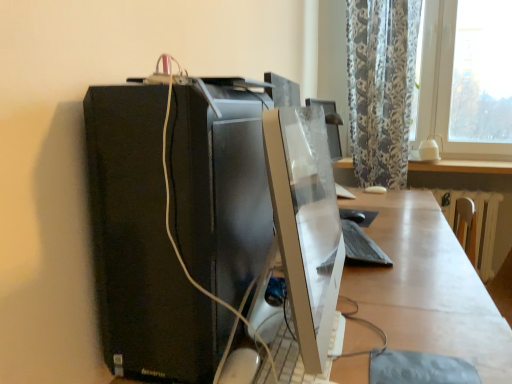
What is the approximate height of white glossy table at lower right?

white glossy table at lower right is 54.20 centimeters tall.

What do you see at coordinates (362, 245) in the screenshot?
I see `black matte keyboard at center` at bounding box center [362, 245].

Image resolution: width=512 pixels, height=384 pixels. Describe the element at coordinates (305, 223) in the screenshot. I see `satin white monitor at center` at that location.

Image resolution: width=512 pixels, height=384 pixels. Describe the element at coordinates (426, 286) in the screenshot. I see `white glossy desk at center` at that location.

The image size is (512, 384). I want to click on black matte computer tower at left, so click(143, 247).

Consider the image. From the image's perspective, which is below, white glossy table at lower right or black matte keyboard at center?

white glossy table at lower right appears lower in the image.

Can we say white glossy table at lower right lies outside black matte keyboard at center?

white glossy table at lower right lies outside black matte keyboard at center's area.

Which object is further away from the camera, white glossy table at lower right or black matte keyboard at center?

black matte keyboard at center.

In order to click on computer monitor in front of the black matte keyboard at center in this screenshot , I will do `click(305, 223)`.

Is black matte keyboard at center looking in the opposite direction of satin white monitor at center?

No, black matte keyboard at center's orientation is not away from satin white monitor at center.

Does point (366, 247) appear closer or farther from the camera than point (269, 164)?

Point (366, 247) is farther from the camera than point (269, 164).

Is black matte keyboard at center not within satin white monitor at center?

Indeed, black matte keyboard at center is completely outside satin white monitor at center.

Is black matte computer tower at left to the left of satin white monitor at center from the viewer's perspective?

A: Indeed, black matte computer tower at left is positioned on the left side of satin white monitor at center.

Does black matte computer tower at left have a lesser width compared to satin white monitor at center?

Incorrect, the width of black matte computer tower at left is not less than that of satin white monitor at center.

Considering the points (157, 148) and (330, 301), which point is behind, point (157, 148) or point (330, 301)?

Positioned behind is point (330, 301).

From a real-world perspective, which is physically below, white glossy desk at center or black matte keyboard at center?

white glossy desk at center is physically lower.

Which object is further away from the camera, white glossy desk at center or black matte keyboard at center?

black matte keyboard at center.

Is white glossy desk at center wider or thinner than black matte keyboard at center?

Considering their sizes, white glossy desk at center looks broader than black matte keyboard at center.

Can you tell me how much white glossy desk at center and black matte keyboard at center differ in facing direction?

There is a 17.7-degree angle between the facing directions of white glossy desk at center and black matte keyboard at center.

In terms of size, does black matte computer tower at left appear bigger or smaller than black matte keyboard at center?

In the image, black matte computer tower at left appears to be larger than black matte keyboard at center.

Would you say black matte keyboard at center is part of black matte computer tower at left's contents?

Definitely not — black matte keyboard at center is not inside black matte computer tower at left.

Is black matte computer tower at left in front of or behind black matte keyboard at center in the image?

black matte computer tower at left is positioned closer to the viewer than black matte keyboard at center.

Considering the sizes of objects satin white monitor at center and white glossy desk at center in the image provided, who is taller, satin white monitor at center or white glossy desk at center?

Standing taller between the two is white glossy desk at center.

Who is smaller, satin white monitor at center or white glossy desk at center?

satin white monitor at center.

Find the location of a particular element. desk directly beneath the satin white monitor at center (from a real-world perspective) is located at coordinates 426,286.

Does black matte keyboard at center have a greater width compared to black matte computer tower at left?

In fact, black matte keyboard at center might be narrower than black matte computer tower at left.

Looking at this image, which of these two, black matte keyboard at center or black matte computer tower at left, stands taller?

With more height is black matte computer tower at left.

Is black matte keyboard at center directly adjacent to black matte computer tower at left?

No.

Does black matte keyboard at center appear on the left side of black matte computer tower at left?

In fact, black matte keyboard at center is to the right of black matte computer tower at left.

Locate an element on the screen. table below the black matte keyboard at center (from a real-world perspective) is located at coordinates (426, 286).

This screenshot has width=512, height=384. In order to click on computer keyboard behind the satin white monitor at center in this screenshot , I will do `click(362, 245)`.

Looking at the image, which one is located further to black matte computer tower at left, white glossy table at lower right or white glossy desk at center?

white glossy desk at center is further to black matte computer tower at left.

Considering their positions, is satin white monitor at center positioned closer to black matte keyboard at center than white glossy desk at center?

Based on the image, white glossy desk at center appears to be nearer to black matte keyboard at center.

Which object lies further to the anchor point white glossy table at lower right, black matte keyboard at center or black matte computer tower at left?

Among the two, black matte computer tower at left is located further to white glossy table at lower right.

Based on their spatial positions, is satin white monitor at center or white glossy desk at center closer to white glossy table at lower right?

white glossy desk at center is closer to white glossy table at lower right.

Based on their spatial positions, is white glossy desk at center or black matte computer tower at left further from black matte keyboard at center?

black matte computer tower at left is further to black matte keyboard at center.

Estimate the real-world distances between objects in this image. Which object is further from black matte keyboard at center, white glossy desk at center or white glossy table at lower right?

white glossy desk at center is further to black matte keyboard at center.

In the scene shown: From the image, which object appears to be farther from satin white monitor at center, white glossy table at lower right or black matte keyboard at center?

black matte keyboard at center is further to satin white monitor at center.

When comparing their distances from white glossy desk at center, does black matte computer tower at left or black matte keyboard at center seem closer?

Among the two, black matte keyboard at center is located nearer to white glossy desk at center.

This screenshot has height=384, width=512. I want to click on computer monitor between black matte computer tower at left and white glossy desk at center in the vertical direction, so click(305, 223).

Where is `computer monitor between black matte computer tower at left and white glossy table at lower right in the horizontal direction`? This screenshot has height=384, width=512. computer monitor between black matte computer tower at left and white glossy table at lower right in the horizontal direction is located at coordinates (305, 223).

I want to click on table between satin white monitor at center and black matte keyboard at center along the z-axis, so click(426, 286).

Locate an element on the screen. The width and height of the screenshot is (512, 384). computer tower between white glossy desk at center and black matte keyboard at center along the z-axis is located at coordinates (143, 247).